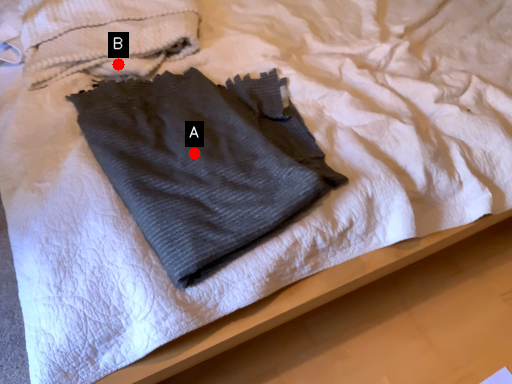
Question: Two points are circled on the image, labeled by A and B beside each circle. Which of the following is the farthest from the observer?

Choices:
 (A) A is further
 (B) B is further

Answer: (B)